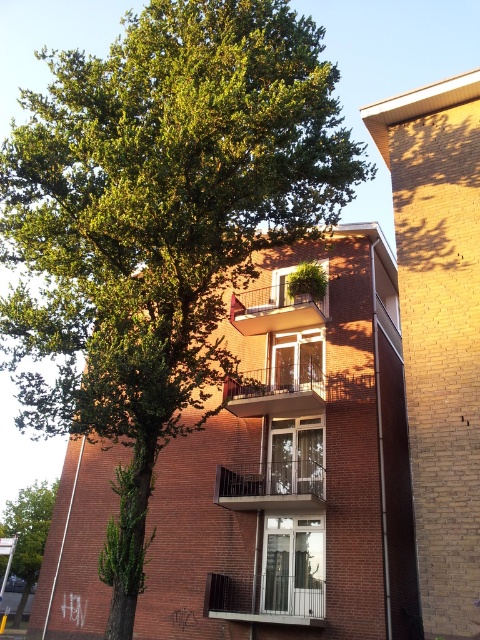
You are standing at the point marked as point (x=311, y=595) in the image. The building is 15 meters tall. If you look straight ahead, will you be able to see the top of the building?

The point (x=311, y=595) is 11.35 meters away from the viewer. Since the building is 15 meters tall, and the distance is 11.35 meters, the angle of elevation required to see the top would be arctangent of 15 divided by 11.35. However, the tree to the left of the building might block the view. Without knowing the tree height and exact position, it is uncertain if the top is visible.

You are standing in front of the residential building and notice two points marked on the facade. The first point is at coordinate point [261,470] and the second is at point [238,314]. Which point is closer to your current position?

Point [261,470] is closer to the camera than point [238,314].